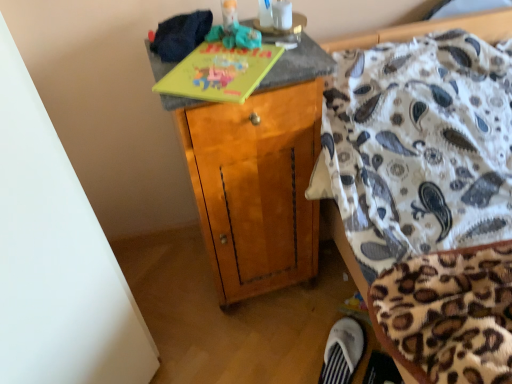
Identify the location of free area in between wooden cabinet at center and white fabric slipper at lower right. click(x=294, y=335).